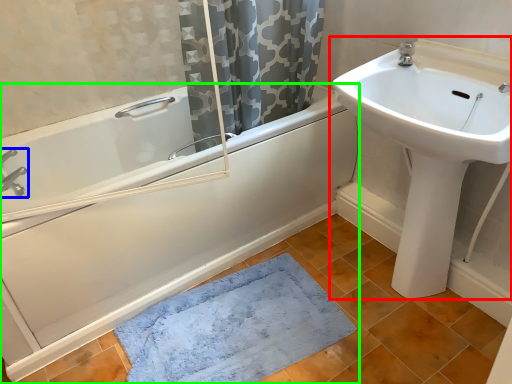
Question: Which is farther away from sink (highlighted by a red box)? tap (highlighted by a blue box) or bathtub (highlighted by a green box)?

Choices:
 (A) tap
 (B) bathtub

Answer: (A)